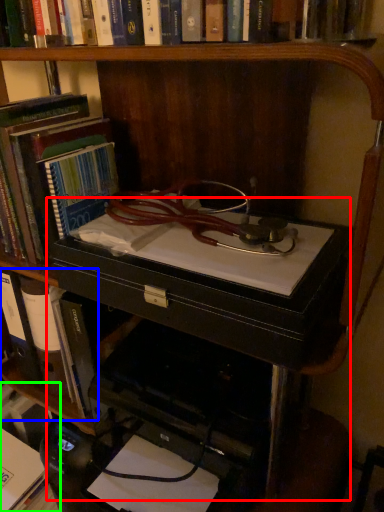
Question: Estimate the real-world distances between objects in this image. Which object is closer to computer desk (highlighted by a red box), book (highlighted by a blue box) or book (highlighted by a green box)?

Choices:
 (A) book
 (B) book

Answer: (A)